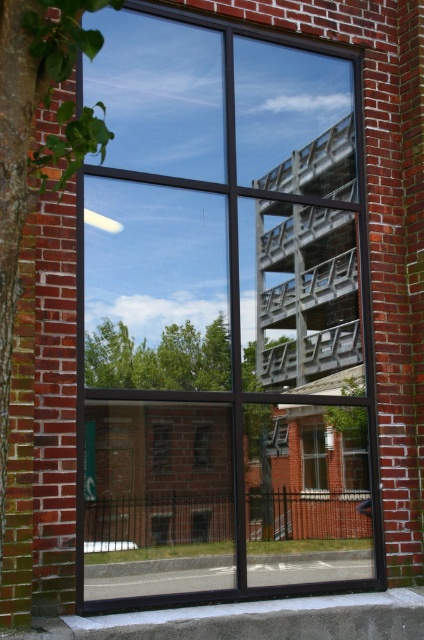
You are standing in front of the window and notice two points marked on the glass. The first point is at coordinate point (61, 1) and the second is at point (315, 460). Which point is closer to your eyes?

Point (61, 1) is closer to the camera than point (315, 460), so the first point is closer to your eyes.

You are standing outside the building and looking at the black glass window at center and the green leafy tree at left. Which object is closer to the ground?

The black glass window at center is positioned under the green leafy tree at left, so the black glass window at center is closer to the ground.